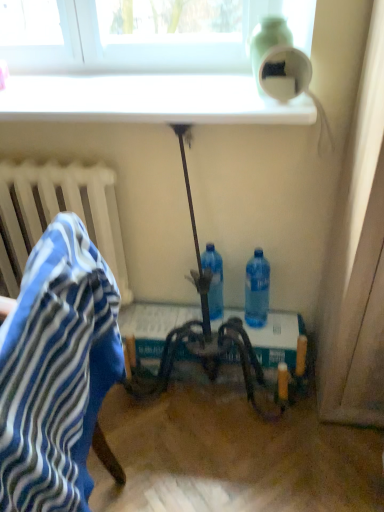
Question: Can you confirm if white glossy window sill at upper center is smaller than green matte bottle at upper right, placed as the third bottle when sorted from bottom to top?

Choices:
 (A) no
 (B) yes

Answer: (A)

Question: From a real-world perspective, does white glossy window sill at upper center stand above green matte bottle at upper right, which is counted as the 1th bottle, starting from the top?

Choices:
 (A) yes
 (B) no

Answer: (B)

Question: Is white glossy window sill at upper center outside of green matte bottle at upper right, placed as the third bottle when sorted from bottom to top?

Choices:
 (A) yes
 (B) no

Answer: (A)

Question: Does white glossy window sill at upper center appear on the left side of green matte bottle at upper right, which is counted as the 1th bottle, starting from the top?

Choices:
 (A) yes
 (B) no

Answer: (A)

Question: Could you tell me if white glossy window sill at upper center is turned towards green matte bottle at upper right, which is counted as the 1th bottle, starting from the top?

Choices:
 (A) no
 (B) yes

Answer: (A)

Question: From the image's perspective, is translucent plastic bottle at center, the second bottle in the top-to-bottom sequence, above or below green matte bottle at upper right, which is counted as the 1th bottle, starting from the top?

Choices:
 (A) above
 (B) below

Answer: (B)

Question: In the image, is translucent plastic bottle at center, the second bottle in the top-to-bottom sequence, on the left side or the right side of green matte bottle at upper right, placed as the third bottle when sorted from bottom to top?

Choices:
 (A) right
 (B) left

Answer: (B)

Question: Relative to green matte bottle at upper right, placed as the third bottle when sorted from bottom to top, is translucent plastic bottle at center, placed as the second bottle when sorted from bottom to top, in front or behind?

Choices:
 (A) front
 (B) behind

Answer: (B)

Question: Is translucent plastic bottle at center, the second bottle in the top-to-bottom sequence, bigger or smaller than green matte bottle at upper right, which is counted as the 1th bottle, starting from the top?

Choices:
 (A) small
 (B) big

Answer: (A)

Question: Looking at their shapes, would you say blue striped fabric at left is wider or thinner than blue plastic bottle at lower center, which is the third bottle in top-to-bottom order?

Choices:
 (A) thin
 (B) wide

Answer: (B)

Question: From the image's perspective, is blue striped fabric at left located above or below blue plastic bottle at lower center, the 1th bottle positioned from the bottom?

Choices:
 (A) below
 (B) above

Answer: (A)

Question: From a real-world perspective, is blue striped fabric at left positioned above or below blue plastic bottle at lower center, which is the third bottle in top-to-bottom order?

Choices:
 (A) below
 (B) above

Answer: (B)

Question: In terms of height, does blue striped fabric at left look taller or shorter compared to blue plastic bottle at lower center, the 1th bottle positioned from the bottom?

Choices:
 (A) short
 (B) tall

Answer: (B)

Question: Looking at their shapes, would you say blue striped fabric at left is wider or thinner than metallic silver table at center?

Choices:
 (A) thin
 (B) wide

Answer: (A)

Question: Relative to metallic silver table at center, is blue striped fabric at left in front or behind?

Choices:
 (A) behind
 (B) front

Answer: (B)